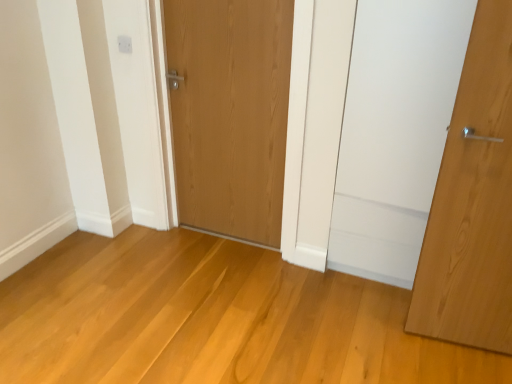
Describe the element at coordinates (473, 202) in the screenshot. This screenshot has height=384, width=512. I see `natural wood door at right, which is the 2th door from left to right` at that location.

What do you see at coordinates (124, 44) in the screenshot? I see `white plastic electric outlet at upper center` at bounding box center [124, 44].

In order to face white plastic electric outlet at upper center, should I rotate leftwards or rightwards?

To face it directly, rotate left by 16.942 degrees.

Find the location of `natural wood door at right, positioned as the 1th door in front-to-back order`. natural wood door at right, positioned as the 1th door in front-to-back order is located at coordinates (473, 202).

Considering the relative sizes of white plastic electric outlet at upper center and wooden door at center, which ranks as the second door in front-to-back order, in the image provided, is white plastic electric outlet at upper center wider than wooden door at center, which ranks as the second door in front-to-back order,?

→ No, white plastic electric outlet at upper center is not wider than wooden door at center, which ranks as the second door in front-to-back order.

From the image's perspective, is white plastic electric outlet at upper center on top of wooden door at center, which ranks as the second door in front-to-back order?

Yes, from the image's perspective, white plastic electric outlet at upper center is on top of wooden door at center, which ranks as the second door in front-to-back order.

Considering the relative sizes of white plastic electric outlet at upper center and wooden door at center, which is counted as the first door, starting from the back, in the image provided, is white plastic electric outlet at upper center shorter than wooden door at center, which is counted as the first door, starting from the back,?

Correct, white plastic electric outlet at upper center is not as tall as wooden door at center, which is counted as the first door, starting from the back.

From a real-world perspective, which object rests below the other?

From a 3D spatial view, natural wood door at right, the second door viewed from the back, is below.

Between white plastic electric outlet at upper center and natural wood door at right, positioned as the 1th door in front-to-back order, which one has less height?

white plastic electric outlet at upper center.

Is point (123, 38) less distant than point (476, 161)?

No.

The image size is (512, 384). There is a white plastic electric outlet at upper center. In order to click on the 2nd door below it (from the image's perspective) in this screenshot , I will do `click(473, 202)`.

Is wooden door at center, which ranks as the second door in front-to-back order, at the back of natural wood door at right, the second door viewed from the back?

That's not correct — natural wood door at right, the second door viewed from the back, is not looking away from wooden door at center, which ranks as the second door in front-to-back order.

From the image's perspective, relative to wooden door at center, which is counted as the first door, starting from the back, is natural wood door at right, the 1th door when ordered from right to left, above or below?

natural wood door at right, the 1th door when ordered from right to left, is situated lower than wooden door at center, which is counted as the first door, starting from the back, in the image.

Between natural wood door at right, which is the 2th door from left to right, and wooden door at center, which ranks as the 1th door in left-to-right order, which one appears on the right side from the viewer's perspective?

Positioned to the right is natural wood door at right, which is the 2th door from left to right.

Are natural wood door at right, the second door viewed from the back, and white plastic electric outlet at upper center far apart?

Yes, natural wood door at right, the second door viewed from the back, and white plastic electric outlet at upper center are located far from each other.

Can we say natural wood door at right, positioned as the 1th door in front-to-back order, lies outside white plastic electric outlet at upper center?

Yes, natural wood door at right, positioned as the 1th door in front-to-back order, is outside of white plastic electric outlet at upper center.

How much distance is there between natural wood door at right, positioned as the 1th door in front-to-back order, and white plastic electric outlet at upper center?

natural wood door at right, positioned as the 1th door in front-to-back order, and white plastic electric outlet at upper center are 6.13 feet apart.

Considering their positions, is wooden door at center, which is the second door from right to left, located in front of or behind natural wood door at right, which is the 2th door from left to right?

wooden door at center, which is the second door from right to left, is positioned farther from the viewer than natural wood door at right, which is the 2th door from left to right.

Is wooden door at center, which is the second door from right to left, located outside natural wood door at right, the 1th door when ordered from right to left?

Yes, wooden door at center, which is the second door from right to left, is outside of natural wood door at right, the 1th door when ordered from right to left.

Considering the relative positions of wooden door at center, which ranks as the second door in front-to-back order, and natural wood door at right, which is the 2th door from left to right, in the image provided, is wooden door at center, which ranks as the second door in front-to-back order, to the left or to the right of natural wood door at right, which is the 2th door from left to right,?

From the image, it's evident that wooden door at center, which ranks as the second door in front-to-back order, is to the left of natural wood door at right, which is the 2th door from left to right.

From a real-world perspective, is wooden door at center, which is the second door from right to left, positioned above or below natural wood door at right, the 1th door when ordered from right to left?

wooden door at center, which is the second door from right to left, is below natural wood door at right, the 1th door when ordered from right to left.

Considering the sizes of objects wooden door at center, which is counted as the first door, starting from the back, and white plastic electric outlet at upper center in the image provided, who is wider, wooden door at center, which is counted as the first door, starting from the back, or white plastic electric outlet at upper center?

wooden door at center, which is counted as the first door, starting from the back.

Can you confirm if wooden door at center, which ranks as the 1th door in left-to-right order, is smaller than white plastic electric outlet at upper center?

Actually, wooden door at center, which ranks as the 1th door in left-to-right order, might be larger than white plastic electric outlet at upper center.

Measure the distance between wooden door at center, which is the second door from right to left, and white plastic electric outlet at upper center.

wooden door at center, which is the second door from right to left, is 27.43 inches away from white plastic electric outlet at upper center.

Considering the positions of point (236, 60) and point (124, 47), is point (236, 60) closer or farther from the camera than point (124, 47)?

Clearly, point (236, 60) is closer to the camera than point (124, 47).

Identify the location of the 1st door counting from the right side of the white plastic electric outlet at upper center. Image resolution: width=512 pixels, height=384 pixels. (230, 113).

Find the location of a particular element. The image size is (512, 384). electric outlet that appears on the left of natural wood door at right, the 1th door when ordered from right to left is located at coordinates (124, 44).

Based on their spatial positions, is white plastic electric outlet at upper center or wooden door at center, which ranks as the second door in front-to-back order, closer to natural wood door at right, positioned as the 1th door in front-to-back order?

Among the two, wooden door at center, which ranks as the second door in front-to-back order, is located nearer to natural wood door at right, positioned as the 1th door in front-to-back order.

Which object lies further to the anchor point white plastic electric outlet at upper center, natural wood door at right, the 1th door when ordered from right to left, or wooden door at center, which ranks as the second door in front-to-back order?

natural wood door at right, the 1th door when ordered from right to left, is further to white plastic electric outlet at upper center.

Looking at the image, which one is located closer to wooden door at center, which is the second door from right to left, white plastic electric outlet at upper center or natural wood door at right, the second door viewed from the back?

Among the two, white plastic electric outlet at upper center is located nearer to wooden door at center, which is the second door from right to left.

From the image, which object appears to be nearer to wooden door at center, which is counted as the first door, starting from the back, natural wood door at right, the second door viewed from the back, or white plastic electric outlet at upper center?

Among the two, white plastic electric outlet at upper center is located nearer to wooden door at center, which is counted as the first door, starting from the back.

From the image, which object appears to be farther from natural wood door at right, the second door viewed from the back, wooden door at center, which ranks as the second door in front-to-back order, or white plastic electric outlet at upper center?

white plastic electric outlet at upper center lies further to natural wood door at right, the second door viewed from the back, than the other object.

Looking at the image, which one is located further to white plastic electric outlet at upper center, wooden door at center, which is counted as the first door, starting from the back, or natural wood door at right, the 1th door when ordered from right to left?

natural wood door at right, the 1th door when ordered from right to left, lies further to white plastic electric outlet at upper center than the other object.

The width and height of the screenshot is (512, 384). I want to click on door situated between white plastic electric outlet at upper center and natural wood door at right, positioned as the 1th door in front-to-back order, from left to right, so click(230, 113).